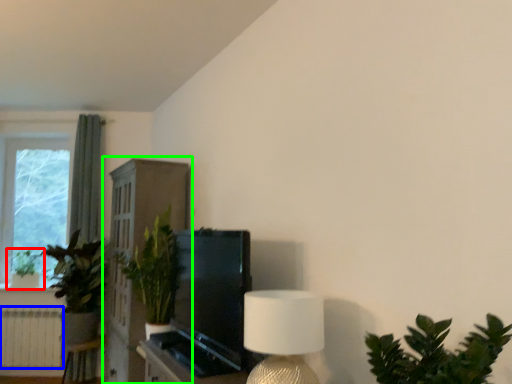
Question: Which is farther away from houseplant (highlighted by a red box)? radiator (highlighted by a blue box) or dresser (highlighted by a green box)?

Choices:
 (A) radiator
 (B) dresser

Answer: (B)